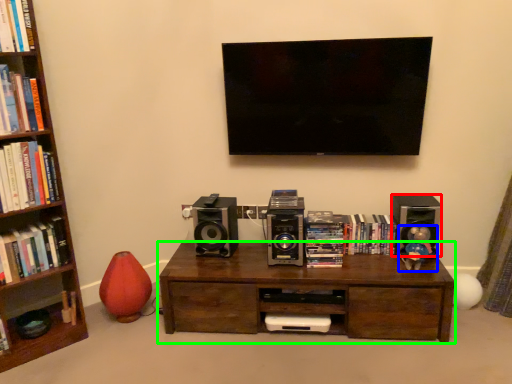
Question: Which is nearer to the speaker (highlighted by a red box)? toy (highlighted by a blue box) or table (highlighted by a green box).

Choices:
 (A) toy
 (B) table

Answer: (A)